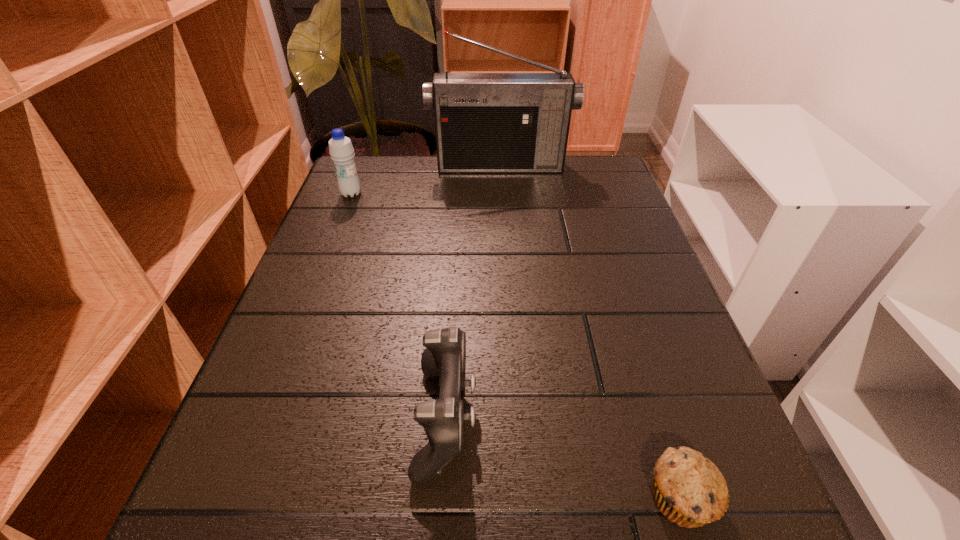
Where is `free space at the far edge of the desktop`? The image size is (960, 540). free space at the far edge of the desktop is located at coordinates (442, 199).

Locate an element on the screen. The image size is (960, 540). free spot at the left edge of the desktop is located at coordinates (301, 478).

Where is `vacant space at the right edge`? vacant space at the right edge is located at coordinates (658, 309).

Locate an element on the screen. free space at the far left corner of the desktop is located at coordinates (365, 180).

The width and height of the screenshot is (960, 540). What are the coordinates of `vacant area at the far right corner` in the screenshot? It's located at (596, 193).

Locate an element on the screen. This screenshot has height=540, width=960. free space at the near right corner of the desktop is located at coordinates (637, 514).

Find the location of a particular element. This screenshot has height=540, width=960. free space between the tallest object and the shortest object is located at coordinates (590, 332).

What are the coordinates of `unoccupied position between the tallest object and the muffin` in the screenshot? It's located at (590, 332).

You are a GUI agent. You are given a task and a screenshot of the screen. Output one action in this format:
    pyautogui.click(x=<x>, y=<y>)
    Task: Click on the vacant area that lies between the control and the radio receiver
    
    Given the screenshot: What is the action you would take?
    pyautogui.click(x=473, y=292)

In order to click on empty space that is in between the tallest object and the second farthest object in this screenshot , I will do `click(425, 180)`.